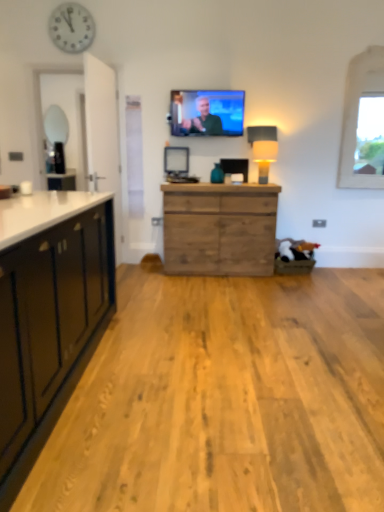
Where is `free space above white stone window at upper right (from a real-world perspective)`? Image resolution: width=384 pixels, height=512 pixels. free space above white stone window at upper right (from a real-world perspective) is located at coordinates (369, 34).